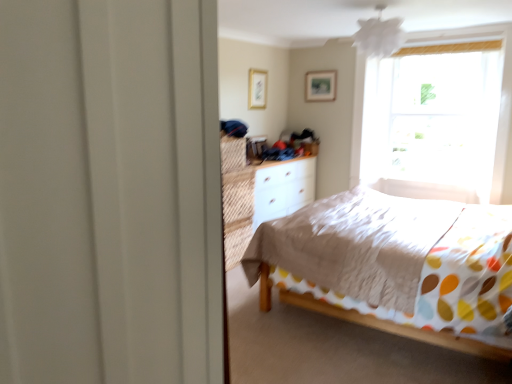
Question: Can you confirm if white textured bed at center is positioned to the left of wooden picture frame at upper center, which appears as the second picture frame when viewed from the back?

Choices:
 (A) no
 (B) yes

Answer: (A)

Question: Is white textured bed at center behind wooden picture frame at upper center, positioned as the 2th picture frame in right-to-left order?

Choices:
 (A) yes
 (B) no

Answer: (B)

Question: Can you confirm if white textured bed at center is taller than wooden picture frame at upper center, positioned as the 2th picture frame in right-to-left order?

Choices:
 (A) yes
 (B) no

Answer: (A)

Question: Is white textured bed at center closer to camera compared to wooden picture frame at upper center, positioned as the 2th picture frame in right-to-left order?

Choices:
 (A) yes
 (B) no

Answer: (A)

Question: Is the surface of white textured bed at center in direct contact with wooden picture frame at upper center, which appears as the second picture frame when viewed from the back?

Choices:
 (A) yes
 (B) no

Answer: (B)

Question: Choose the correct answer: Is white textured bed at center inside white matte dresser at center or outside it?

Choices:
 (A) outside
 (B) inside

Answer: (A)

Question: Based on their positions, is white textured bed at center located to the left or right of white matte dresser at center?

Choices:
 (A) left
 (B) right

Answer: (B)

Question: Considering their positions, is white textured bed at center located in front of or behind white matte dresser at center?

Choices:
 (A) behind
 (B) front

Answer: (B)

Question: Considering the positions of white textured bed at center and white matte dresser at center in the image, is white textured bed at center wider or thinner than white matte dresser at center?

Choices:
 (A) thin
 (B) wide

Answer: (B)

Question: Considering the positions of white matte dresser at center and white textured bed at center in the image, is white matte dresser at center bigger or smaller than white textured bed at center?

Choices:
 (A) small
 (B) big

Answer: (A)

Question: Is white matte dresser at center taller or shorter than white textured bed at center?

Choices:
 (A) short
 (B) tall

Answer: (A)

Question: Is white matte dresser at center inside or outside of white textured bed at center?

Choices:
 (A) outside
 (B) inside

Answer: (A)

Question: In terms of width, does white matte dresser at center look wider or thinner when compared to white textured bed at center?

Choices:
 (A) thin
 (B) wide

Answer: (A)

Question: In terms of width, does white textured bed at center look wider or thinner when compared to wooden picture frame at upper center, the second picture frame positioned from the front?

Choices:
 (A) wide
 (B) thin

Answer: (A)

Question: From a real-world perspective, is white textured bed at center physically located above or below wooden picture frame at upper center, the first picture frame from the right?

Choices:
 (A) below
 (B) above

Answer: (A)